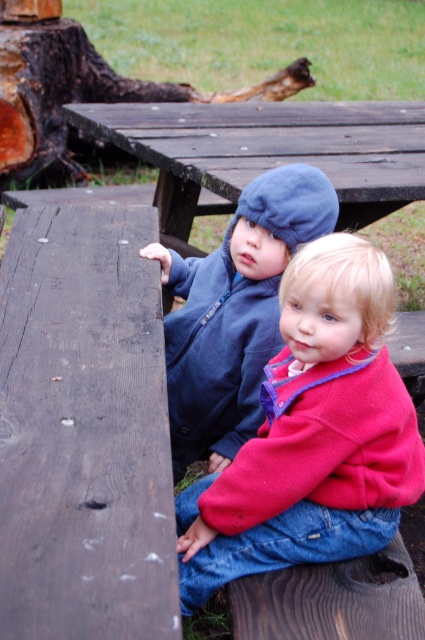
Question: Which object appears closest to the camera in this image?

Choices:
 (A) charred wood log at upper center
 (B) dark brown wooden picnic table at center

Answer: (B)

Question: Which of the following is the closest to the observer?

Choices:
 (A) (218, 188)
 (B) (221, 467)
 (C) (297, 502)

Answer: (C)

Question: From the image, what is the correct spatial relationship of dark brown wooden picnic table at center in relation to blue fleece jacket at center?

Choices:
 (A) right
 (B) left

Answer: (A)

Question: Can you confirm if red fleece jacket at center is wider than blue fleece jacket at center?

Choices:
 (A) yes
 (B) no

Answer: (A)

Question: Is blue fleece jacket at center thinner than charred wood log at upper center?

Choices:
 (A) no
 (B) yes

Answer: (B)

Question: Among these objects, which one is nearest to the camera?

Choices:
 (A) red fleece jacket at center
 (B) charred wood log at upper center

Answer: (A)